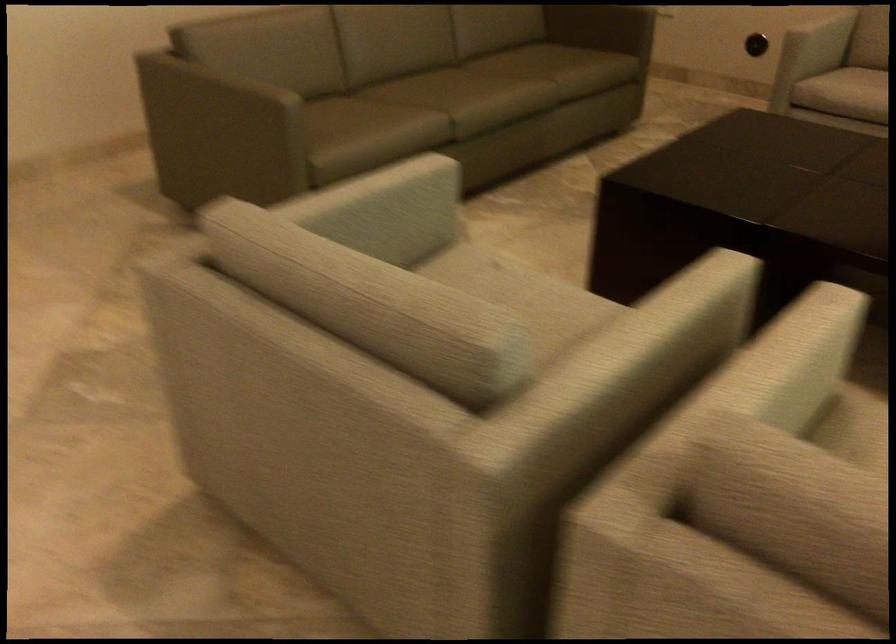
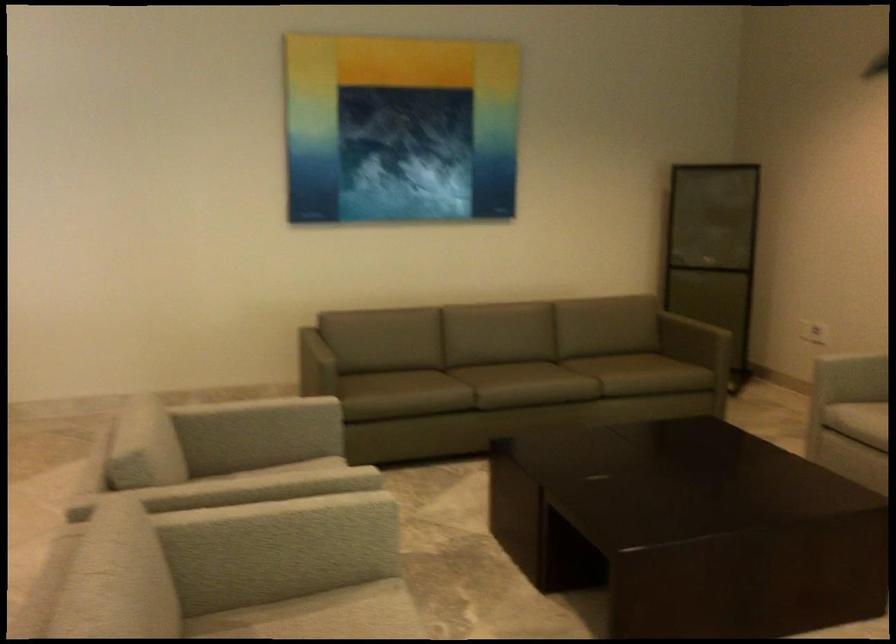
In the second image, find the point that corresponds to the point at 512,99 in the first image.

(524, 384)